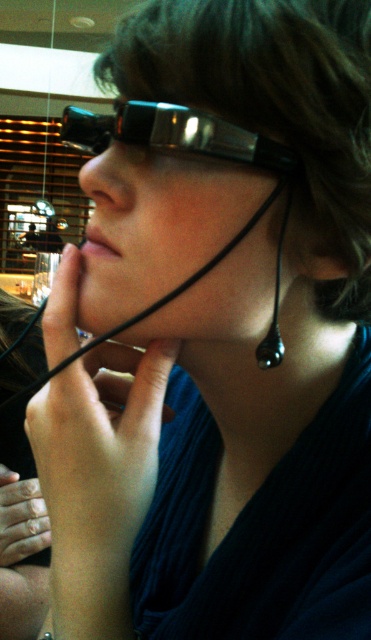
Can you confirm if black glossy glasses at center is positioned to the left of black glossy earring at lower right?

Indeed, black glossy glasses at center is positioned on the left side of black glossy earring at lower right.

Is black glossy glasses at center smaller than black glossy earring at lower right?

Incorrect, black glossy glasses at center is not smaller in size than black glossy earring at lower right.

This screenshot has width=371, height=640. Identify the location of black glossy glasses at center. (173, 134).

Find the location of `black glossy glasses at center`. black glossy glasses at center is located at coordinates (173, 134).